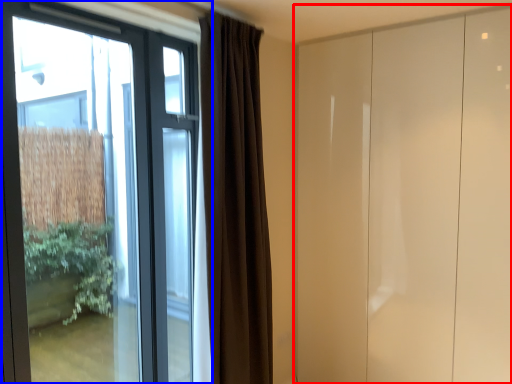
Question: Which of the following is the closest to the observer, door (highlighted by a red box) or window (highlighted by a blue box)?

Choices:
 (A) door
 (B) window

Answer: (B)